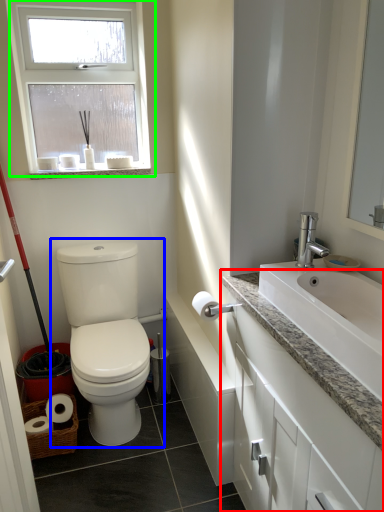
Question: Estimate the real-world distances between objects in this image. Which object is closer to bathroom cabinet (highlighted by a red box), toilet (highlighted by a blue box) or window (highlighted by a green box)?

Choices:
 (A) toilet
 (B) window

Answer: (A)